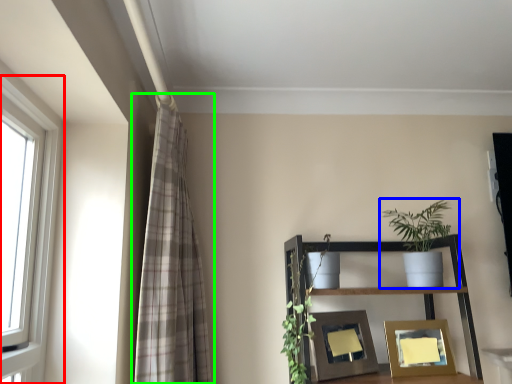
Question: Based on their relative distances, which object is farther from window (highlighted by a red box)? Choose from houseplant (highlighted by a blue box) and curtain (highlighted by a green box).

Choices:
 (A) houseplant
 (B) curtain

Answer: (A)